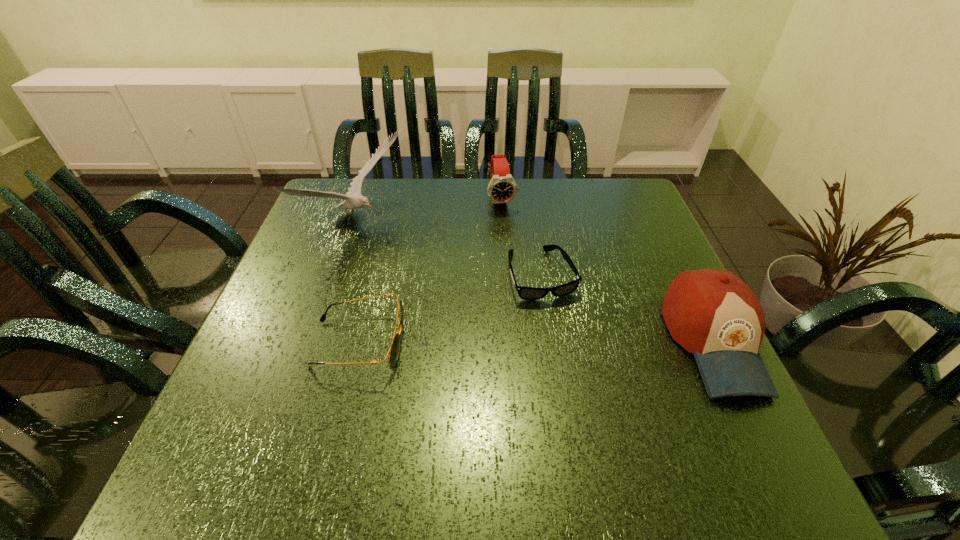
Where is `blank space at the far right corner`? This screenshot has height=540, width=960. blank space at the far right corner is located at coordinates (x=602, y=183).

What are the coordinates of `blank space at the near right corner of the desktop` in the screenshot? It's located at (646, 389).

This screenshot has width=960, height=540. I want to click on empty location between the shortest object and the rightmost object, so click(x=628, y=308).

Image resolution: width=960 pixels, height=540 pixels. Identify the location of free area in between the second shortest object and the watch. (430, 271).

The height and width of the screenshot is (540, 960). I want to click on vacant space that is in between the rightmost object and the right sunglasses, so click(x=628, y=308).

Where is `vacant area between the taller sunglasses and the watch`? vacant area between the taller sunglasses and the watch is located at coordinates (430, 271).

The height and width of the screenshot is (540, 960). I want to click on free space between the watch and the baseball cap, so click(608, 271).

Where is `vacant area that lies between the gull and the watch`? Image resolution: width=960 pixels, height=540 pixels. vacant area that lies between the gull and the watch is located at coordinates (429, 212).

The width and height of the screenshot is (960, 540). Identify the location of vacant point located between the nearer sunglasses and the shortest object. (450, 309).

The image size is (960, 540). Find the location of `free spot between the left sunglasses and the farther sunglasses`. free spot between the left sunglasses and the farther sunglasses is located at coordinates (450, 309).